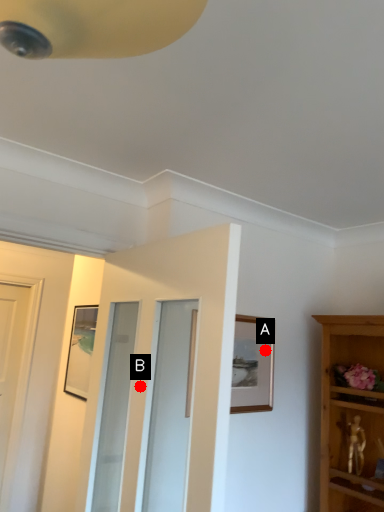
Question: Two points are circled on the image, labeled by A and B beside each circle. Which of the following is the closest to the observer?

Choices:
 (A) A is closer
 (B) B is closer

Answer: (B)